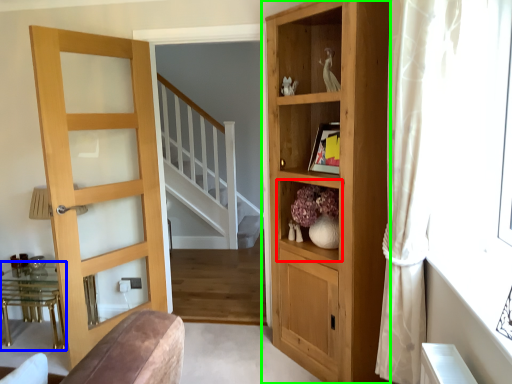
Question: Considering the real-world distances, which object is closest to shelf (highlighted by a red box)? table (highlighted by a blue box) or cupboard (highlighted by a green box).

Choices:
 (A) table
 (B) cupboard

Answer: (B)